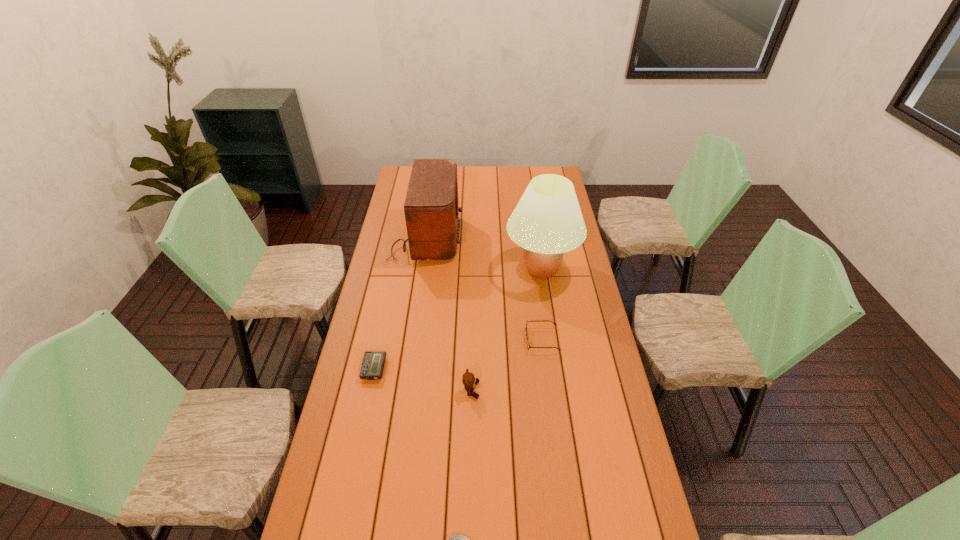
This screenshot has height=540, width=960. Find the location of `vacant space located on the lenses of the fourth nearest object`. vacant space located on the lenses of the fourth nearest object is located at coordinates (504, 340).

This screenshot has width=960, height=540. What are the coordinates of `free spot located on the lenses of the fourth nearest object` in the screenshot? It's located at (493, 340).

Find the location of a particular element. free space located on the lenses of the fourth nearest object is located at coordinates (491, 340).

Where is `vacant space situated 0.380m on the back of the beeper`? The height and width of the screenshot is (540, 960). vacant space situated 0.380m on the back of the beeper is located at coordinates (392, 283).

Locate an element on the screen. radio receiver that is positioned at the left edge is located at coordinates (431, 208).

You are a GUI agent. You are given a task and a screenshot of the screen. Output one action in this format:
    pyautogui.click(x=<x>, y=<y>)
    Task: Click on the beeper that is at the left edge
    
    Given the screenshot: What is the action you would take?
    pyautogui.click(x=373, y=362)

Locate an element on the screen. The height and width of the screenshot is (540, 960). object that is at the right edge is located at coordinates (547, 221).

Locate an element on the screen. This screenshot has width=960, height=540. free point at the far edge is located at coordinates (480, 188).

At what (x,y) coordinates should I click in order to perform the action: click on free space at the left edge. Please return your answer as a coordinate pair (x, y). Looking at the image, I should click on (399, 215).

Image resolution: width=960 pixels, height=540 pixels. Identify the location of vacant area at the right edge. (594, 399).